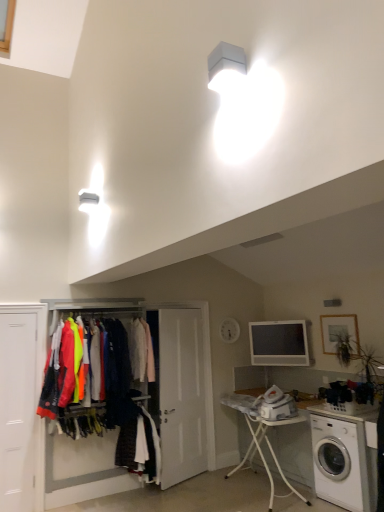
The height and width of the screenshot is (512, 384). What do you see at coordinates (43, 428) in the screenshot?
I see `matte plastic clothes rack at lower left` at bounding box center [43, 428].

What do you see at coordinates (21, 406) in the screenshot?
I see `white matte door at left` at bounding box center [21, 406].

This screenshot has height=512, width=384. What do you see at coordinates (344, 459) in the screenshot?
I see `white plastic washing machine at lower right` at bounding box center [344, 459].

Where is `matte gray lamp at upper center`? The width and height of the screenshot is (384, 512). matte gray lamp at upper center is located at coordinates (226, 67).

This screenshot has height=512, width=384. Identify the location of white glossy door at center. (181, 395).

Locate an element on the screen. armoire above the white matte door at left (from the image's perspective) is located at coordinates (43, 428).

Looking at this image, considering the relative sizes of matte plastic clothes rack at lower left and white matte door at left in the image provided, is matte plastic clothes rack at lower left wider than white matte door at left?

Yes.

Considering the positions of objects matte plastic clothes rack at lower left and white matte door at left in the image provided, who is more to the right, matte plastic clothes rack at lower left or white matte door at left?

matte plastic clothes rack at lower left.

Is matte plastic clothes rack at lower left inside the boundaries of white matte door at left, or outside?

matte plastic clothes rack at lower left is not enclosed by white matte door at left.

From a real-world perspective, is white plastic washing machine at lower right beneath white cotton shirt at center, which is counted as the 1th clothing, starting from the bottom?

Yes, from a real-world perspective, white plastic washing machine at lower right is under white cotton shirt at center, which is counted as the 1th clothing, starting from the bottom.

From the picture: Is white cotton shirt at center, which is counted as the 1th clothing, starting from the bottom, at the back of white plastic washing machine at lower right?

No.

Based on the photo, considering the sizes of white plastic washing machine at lower right and white cotton shirt at center, the 3th clothing from the top, in the image, is white plastic washing machine at lower right taller or shorter than white cotton shirt at center, the 3th clothing from the top,?

white plastic washing machine at lower right is shorter than white cotton shirt at center, the 3th clothing from the top.

Is matte gray lamp at upper center turned away from neon fabric jackets at center, which is the second clothing from bottom to top?

No, neon fabric jackets at center, which is the second clothing from bottom to top, is not at the back of matte gray lamp at upper center.

Is matte gray lamp at upper center located outside neon fabric jackets at center, which is the second clothing from bottom to top?

Yes.

Is matte gray lamp at upper center bigger or smaller than neon fabric jackets at center, which is the second clothing from bottom to top?

Considering their sizes, matte gray lamp at upper center takes up less space than neon fabric jackets at center, which is the second clothing from bottom to top.

Considering the relative sizes of matte gray lamp at upper center and neon fabric jackets at center, which is the second clothing from bottom to top, in the image provided, is matte gray lamp at upper center shorter than neon fabric jackets at center, which is the second clothing from bottom to top,?

Yes, matte gray lamp at upper center is shorter than neon fabric jackets at center, which is the second clothing from bottom to top.

How different are the orientations of white plastic washing machine at lower right and white matte door at left in degrees?

There is a 90.1-degree angle between the facing directions of white plastic washing machine at lower right and white matte door at left.

Considering the sizes of white plastic washing machine at lower right and white matte door at left in the image, is white plastic washing machine at lower right wider or thinner than white matte door at left?

Considering their sizes, white plastic washing machine at lower right looks broader than white matte door at left.

The width and height of the screenshot is (384, 512). In order to click on washing machine lying in front of the white matte door at left in this screenshot , I will do `click(344, 459)`.

From the image's perspective, which one is positioned lower, white plastic washing machine at lower right or white matte door at left?

From the image's view, white plastic washing machine at lower right is below.

From the picture: Measure the distance from white fabric coat at center, the 3th clothing when ordered from bottom to top, to white cotton shirt at center, which is counted as the 1th clothing, starting from the bottom.

27.57 inches.

From a real-world perspective, is white fabric coat at center, acting as the 1th clothing starting from the top, positioned under white cotton shirt at center, the 3th clothing from the top, based on gravity?

No, from a real-world perspective, white fabric coat at center, acting as the 1th clothing starting from the top, is not below white cotton shirt at center, the 3th clothing from the top.

From the image's perspective, which is above, white fabric coat at center, acting as the 1th clothing starting from the top, or white cotton shirt at center, which is counted as the 1th clothing, starting from the bottom?

From the image's view, white fabric coat at center, acting as the 1th clothing starting from the top, is above.

Locate an element on the screen. The height and width of the screenshot is (512, 384). clothing on the right side of white cotton shirt at center, which is counted as the 1th clothing, starting from the bottom is located at coordinates (141, 350).

Considering the sizes of white cotton shirt at center, which is counted as the 1th clothing, starting from the bottom, and white plastic ironing board at lower center in the image, is white cotton shirt at center, which is counted as the 1th clothing, starting from the bottom, bigger or smaller than white plastic ironing board at lower center?

Considering their sizes, white cotton shirt at center, which is counted as the 1th clothing, starting from the bottom, takes up less space than white plastic ironing board at lower center.

Is white cotton shirt at center, which is counted as the 1th clothing, starting from the bottom, oriented away from white plastic ironing board at lower center?

white cotton shirt at center, which is counted as the 1th clothing, starting from the bottom, is not turned away from white plastic ironing board at lower center.

From a real-world perspective, is white cotton shirt at center, which is counted as the 1th clothing, starting from the bottom, on white plastic ironing board at lower center?

Yes, from a real-world perspective, white cotton shirt at center, which is counted as the 1th clothing, starting from the bottom, is on top of white plastic ironing board at lower center.

Is white matte door at left situated inside white glossy door at center or outside?

white matte door at left is located beyond the bounds of white glossy door at center.

Which of these two, white matte door at left or white glossy door at center, stands taller?

With more height is white glossy door at center.

Who is smaller, white matte door at left or white glossy door at center?

With smaller size is white matte door at left.

You are a GUI agent. You are given a task and a screenshot of the screen. Output one action in this format:
    pyautogui.click(x=<x>, y=<y>)
    Task: Click on the armoire in front of the white matte door at left
    
    Given the screenshot: What is the action you would take?
    pyautogui.click(x=43, y=428)

The height and width of the screenshot is (512, 384). I want to click on clothing that is the 2nd one when counting leftward from the white plastic washing machine at lower right, so click(x=140, y=446).

Which object lies further to the anchor point matte plastic clothes rack at lower left, white fabric coat at center, acting as the 1th clothing starting from the top, or neon fabric jackets at center, the second clothing when ordered from top to bottom?

white fabric coat at center, acting as the 1th clothing starting from the top, is positioned further to the anchor matte plastic clothes rack at lower left.

Based on their spatial positions, is matte gray lamp at upper center or white plastic washing machine at lower right further from white matte door at left?

Based on the image, matte gray lamp at upper center appears to be further to white matte door at left.

Considering their positions, is white cotton shirt at center, the 3th clothing from the top, positioned further to white plastic ironing board at lower center than matte plastic clothes rack at lower left?

matte plastic clothes rack at lower left lies further to white plastic ironing board at lower center than the other object.

Which object lies further to the anchor point white glossy door at center, matte gray lamp at upper center or white plastic ironing board at lower center?

matte gray lamp at upper center is further to white glossy door at center.

Looking at the image, which one is located further to white glossy door at center, white fabric coat at center, the 3th clothing when ordered from bottom to top, or white matte door at left?

white matte door at left is further to white glossy door at center.

From the image, which object appears to be nearer to matte gray lamp at upper center, matte gray monitor at center or white glossy door at center?

matte gray monitor at center is positioned closer to the anchor matte gray lamp at upper center.

Looking at the image, which one is located closer to white plastic ironing board at lower center, white glossy door at center or matte plastic clothes rack at lower left?

The object closer to white plastic ironing board at lower center is white glossy door at center.

Looking at this image, which object lies further to the anchor point matte plastic clothes rack at lower left, neon fabric jackets at center, the second clothing when ordered from top to bottom, or white plastic ironing board at lower center?

white plastic ironing board at lower center lies further to matte plastic clothes rack at lower left than the other object.

You are a GUI agent. You are given a task and a screenshot of the screen. Output one action in this format:
    pyautogui.click(x=<x>, y=<y>)
    Task: Click on the table between white fabric coat at center, acting as the 1th clothing starting from the top, and white plastic washing machine at lower right
    This screenshot has height=512, width=384.
    Given the screenshot: What is the action you would take?
    pyautogui.click(x=261, y=438)

Find the location of a particular element. armoire between white matte door at left and white cotton shirt at center, the 3th clothing from the top, from left to right is located at coordinates (43, 428).

Find the location of `washing machine that lies between matte gray lamp at upper center and white plastic ironing board at lower center from top to bottom`. washing machine that lies between matte gray lamp at upper center and white plastic ironing board at lower center from top to bottom is located at coordinates (344, 459).

Image resolution: width=384 pixels, height=512 pixels. I want to click on armoire located between matte gray lamp at upper center and matte gray monitor at center in the depth direction, so (43, 428).